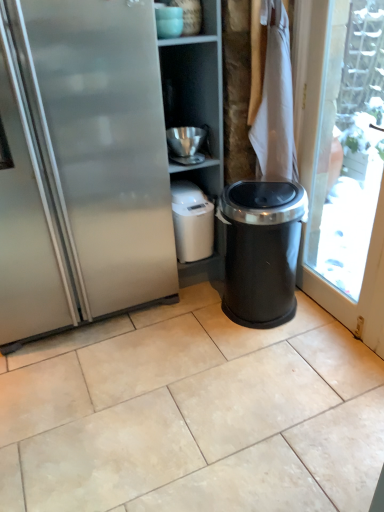
Question: Is black plastic trash can at right closer to camera compared to white fabric at upper right?

Choices:
 (A) no
 (B) yes

Answer: (B)

Question: Does black plastic trash can at right have a greater width compared to white fabric at upper right?

Choices:
 (A) yes
 (B) no

Answer: (A)

Question: Does black plastic trash can at right have a larger size compared to white fabric at upper right?

Choices:
 (A) yes
 (B) no

Answer: (A)

Question: Is black plastic trash can at right facing towards white fabric at upper right?

Choices:
 (A) no
 (B) yes

Answer: (A)

Question: Is black plastic trash can at right behind white fabric at upper right?

Choices:
 (A) yes
 (B) no

Answer: (B)

Question: Considering the positions of white matte appliance at center, which appears as the 3th appliance when viewed from the top, and metallic silver bowl at upper center, marked as the 2th appliance in a top-to-bottom arrangement, in the image, is white matte appliance at center, which appears as the 3th appliance when viewed from the top, bigger or smaller than metallic silver bowl at upper center, marked as the 2th appliance in a top-to-bottom arrangement,?

Choices:
 (A) big
 (B) small

Answer: (A)

Question: Is white matte appliance at center, arranged as the first appliance when viewed from the back, in front of or behind metallic silver bowl at upper center, marked as the 2th appliance in a top-to-bottom arrangement, in the image?

Choices:
 (A) behind
 (B) front

Answer: (A)

Question: From a real-world perspective, is white matte appliance at center, which appears as the 1th appliance when ordered from the bottom, above or below metallic silver bowl at upper center, which ranks as the second appliance in bottom-to-top order?

Choices:
 (A) above
 (B) below

Answer: (B)

Question: Is white matte appliance at center, which appears as the 3th appliance when viewed from the top, taller or shorter than metallic silver bowl at upper center, marked as the 2th appliance in a top-to-bottom arrangement?

Choices:
 (A) tall
 (B) short

Answer: (A)

Question: From the image's perspective, is matte ceramic bowl at upper center, acting as the 3th appliance starting from the bottom, above or below white matte appliance at center, which appears as the 1th appliance when ordered from the bottom?

Choices:
 (A) below
 (B) above

Answer: (B)

Question: Is matte ceramic bowl at upper center, marked as the 1th appliance in a front-to-back arrangement, to the left or to the right of white matte appliance at center, which appears as the 1th appliance when ordered from the bottom, in the image?

Choices:
 (A) right
 (B) left

Answer: (B)

Question: Considering the positions of matte ceramic bowl at upper center, which is the third appliance in back-to-front order, and white matte appliance at center, which appears as the 1th appliance when ordered from the bottom, in the image, is matte ceramic bowl at upper center, which is the third appliance in back-to-front order, taller or shorter than white matte appliance at center, which appears as the 1th appliance when ordered from the bottom,?

Choices:
 (A) tall
 (B) short

Answer: (B)

Question: Based on their sizes in the image, would you say matte ceramic bowl at upper center, the first appliance from the top, is bigger or smaller than white matte appliance at center, arranged as the first appliance when viewed from the back?

Choices:
 (A) small
 (B) big

Answer: (A)

Question: Considering the positions of black plastic trash can at right and matte ceramic bowl at upper center, acting as the 3th appliance starting from the bottom, in the image, is black plastic trash can at right bigger or smaller than matte ceramic bowl at upper center, acting as the 3th appliance starting from the bottom,?

Choices:
 (A) big
 (B) small

Answer: (A)

Question: Is black plastic trash can at right taller or shorter than matte ceramic bowl at upper center, the first appliance from the top?

Choices:
 (A) tall
 (B) short

Answer: (A)